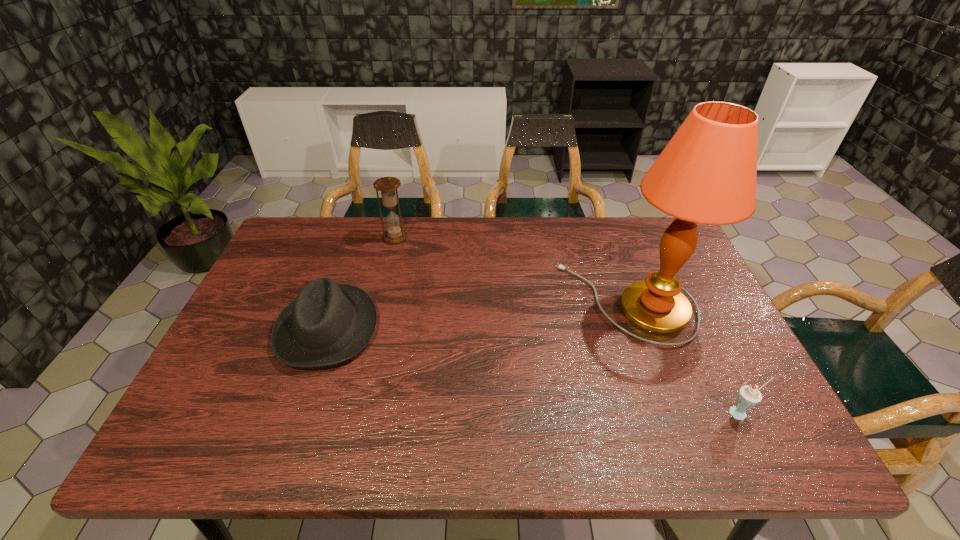
You are a GUI agent. You are given a task and a screenshot of the screen. Output one action in this format:
    pyautogui.click(x=<x>, y=<y>)
    Task: Click on the object at the near edge
    
    Given the screenshot: What is the action you would take?
    pyautogui.click(x=749, y=396)

Identify the location of object that is at the left edge. The image size is (960, 540). (328, 323).

Locate an element on the screen. Image resolution: width=960 pixels, height=540 pixels. lamp at the right edge is located at coordinates (706, 174).

Locate an element on the screen. This screenshot has height=540, width=960. milkshake positioned at the right edge is located at coordinates (749, 396).

At what (x,y) coordinates should I click in order to perform the action: click on object that is at the near right corner. Please return your answer as a coordinate pair (x, y). The image size is (960, 540). Looking at the image, I should click on (749, 396).

In the image, there is a desktop. Identify the location of blank space at the far edge. (441, 259).

Where is `free location at the near edge`? This screenshot has height=540, width=960. free location at the near edge is located at coordinates (515, 420).

This screenshot has width=960, height=540. Find the location of `free space at the left edge of the desktop`. free space at the left edge of the desktop is located at coordinates (261, 289).

Image resolution: width=960 pixels, height=540 pixels. In the image, there is a desktop. What are the coordinates of `vacant space at the right edge` in the screenshot? It's located at (706, 318).

This screenshot has width=960, height=540. Identify the location of free space at the far left corner of the desktop. (319, 250).